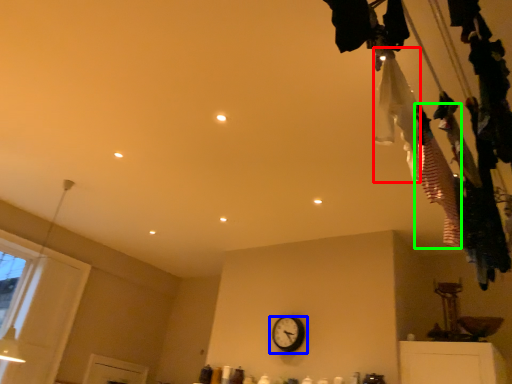
Question: Which is farther away from clothing (highlighted by a red box)? wall clock (highlighted by a blue box) or clothing (highlighted by a green box)?

Choices:
 (A) wall clock
 (B) clothing

Answer: (A)